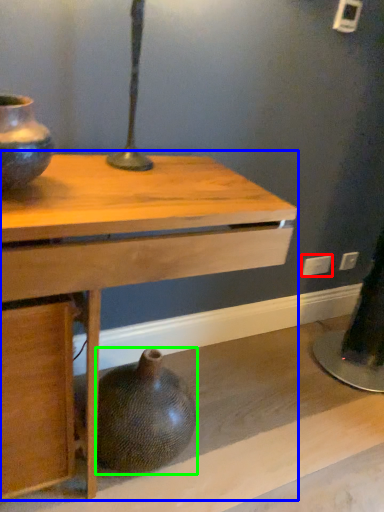
Question: Based on their relative distances, which object is nearer to electric outlet (highlighted by a red box)? Choose from table (highlighted by a blue box) and vase (highlighted by a green box).

Choices:
 (A) table
 (B) vase

Answer: (B)